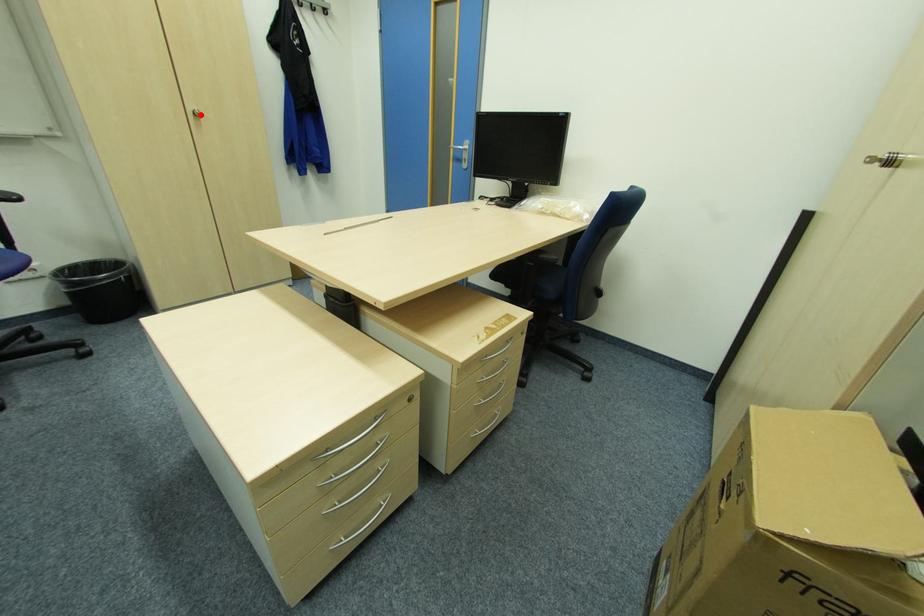
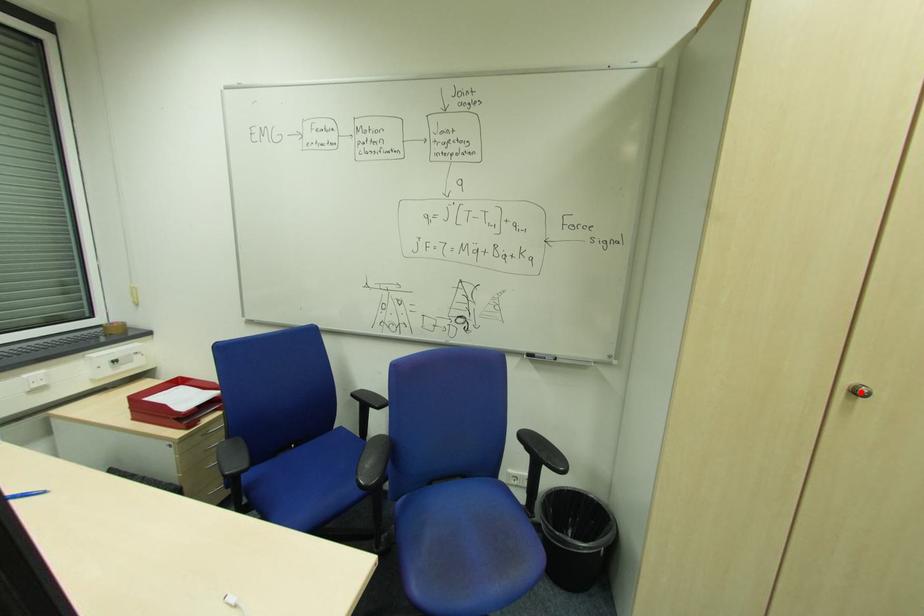
I am providing you with two images of the same scene from different viewpoints. A red point is marked on the first image and another point is marked on the second image. Do the highlighted points in image1 and image2 indicate the same real-world spot?

Yes